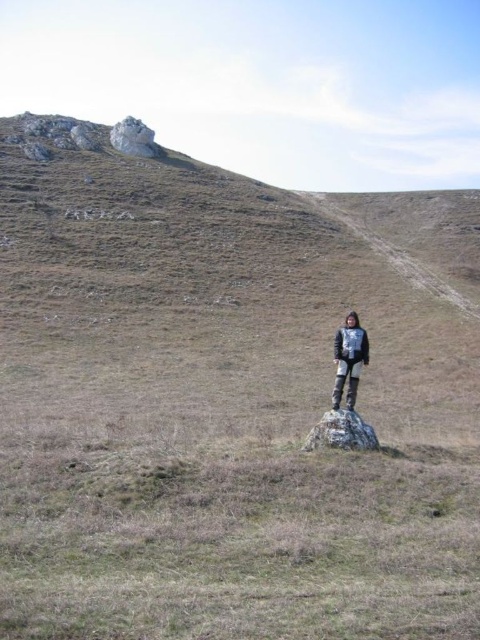
Does gray rough rock at center appear over white rocky peak at upper left?

No.

Between gray rough rock at center and white rocky peak at upper left, which one is positioned lower?

gray rough rock at center is below.

What do you see at coordinates (340, 433) in the screenshot?
I see `gray rough rock at center` at bounding box center [340, 433].

Where is `gray rough rock at center`? gray rough rock at center is located at coordinates (340, 433).

This screenshot has width=480, height=640. I want to click on gray fabric jacket at center, so click(348, 358).

Can you confirm if gray fabric jacket at center is positioned below gray rough rock at center?

Incorrect, gray fabric jacket at center is not positioned below gray rough rock at center.

Is point (352, 340) behind point (357, 440)?

Yes, point (352, 340) is farther from viewer.

Locate an element on the screen. This screenshot has height=640, width=480. gray fabric jacket at center is located at coordinates (348, 358).

Between gray fabric jacket at center and white rocky peak at upper left, which one has less height?

gray fabric jacket at center

Does gray fabric jacket at center appear over white rocky peak at upper left?

No, gray fabric jacket at center is not above white rocky peak at upper left.

You are a GUI agent. You are given a task and a screenshot of the screen. Output one action in this format:
    pyautogui.click(x=<x>, y=<y>)
    Task: Click on the gray fabric jacket at center
    Image resolution: width=480 pixels, height=640 pixels.
    Given the screenshot: What is the action you would take?
    pyautogui.click(x=348, y=358)